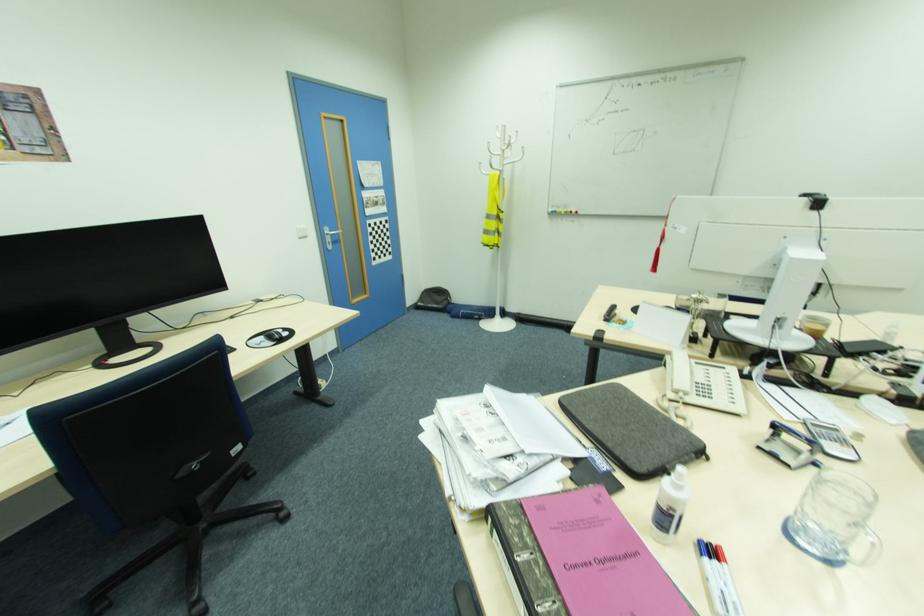
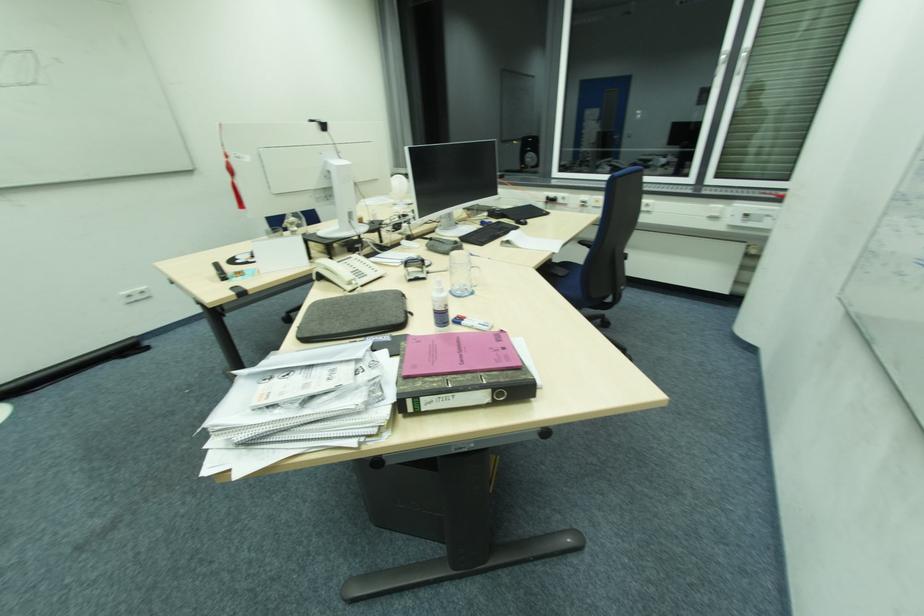
Find the pixel in the second image that matches the point at 590,426 in the first image.

(348, 331)